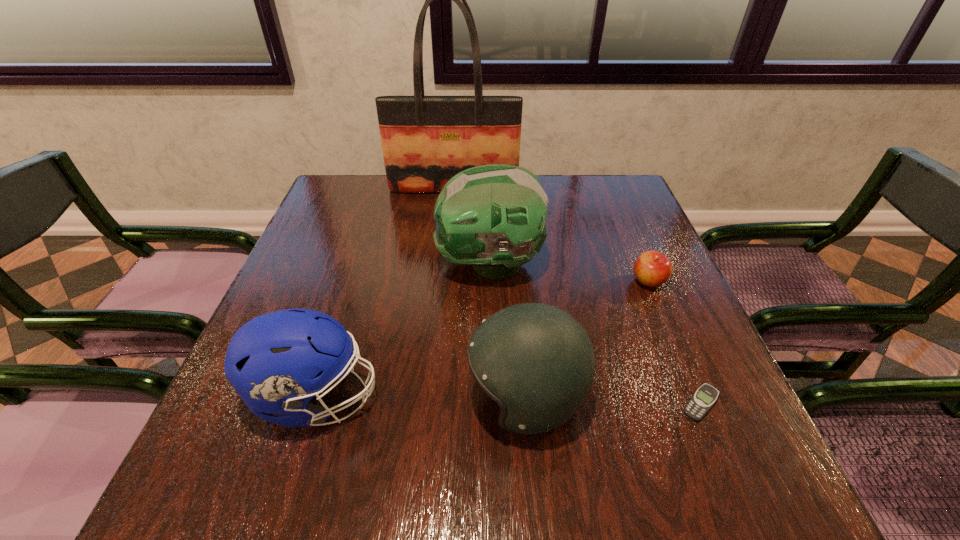
This screenshot has height=540, width=960. Find the location of `vacant space located on the visor of the fifth shortest object`. vacant space located on the visor of the fifth shortest object is located at coordinates (316, 264).

I want to click on free space located 0.160m on the front-facing side of the leftmost football helmet, so click(468, 397).

Identify the location of blank space located on the left of the apple. The image size is (960, 540). (579, 281).

I want to click on free space located on the left of the shortest object, so click(516, 404).

Find the location of `object located at the far edge`. object located at the far edge is located at coordinates pos(426,140).

Where is `object present at the left edge`? The height and width of the screenshot is (540, 960). object present at the left edge is located at coordinates (273, 361).

This screenshot has width=960, height=540. Find the location of `apple that is at the right edge`. apple that is at the right edge is located at coordinates (652, 268).

At what (x,y) coordinates should I click in order to perform the action: click on beeper situated at the right edge. Please return your answer as a coordinate pair (x, y). The image size is (960, 540). Looking at the image, I should click on pyautogui.click(x=702, y=400).

In the image, there is a desktop. Where is `free space at the far edge`? Image resolution: width=960 pixels, height=540 pixels. free space at the far edge is located at coordinates (562, 215).

In the image, there is a desktop. At what (x,y) coordinates should I click in order to perform the action: click on free region at the near edge. Please return your answer as a coordinate pair (x, y). Image resolution: width=960 pixels, height=540 pixels. Looking at the image, I should click on (612, 503).